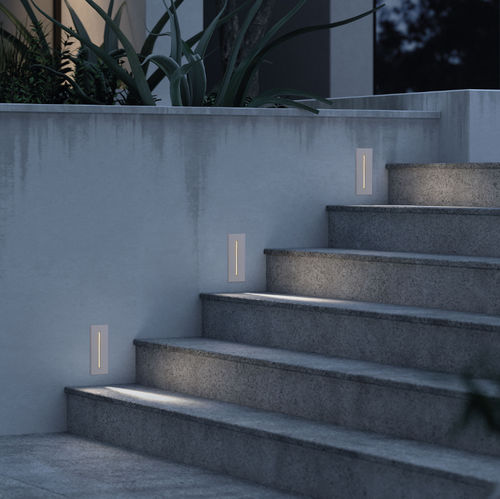
This screenshot has width=500, height=499. I want to click on window, so click(x=437, y=59).